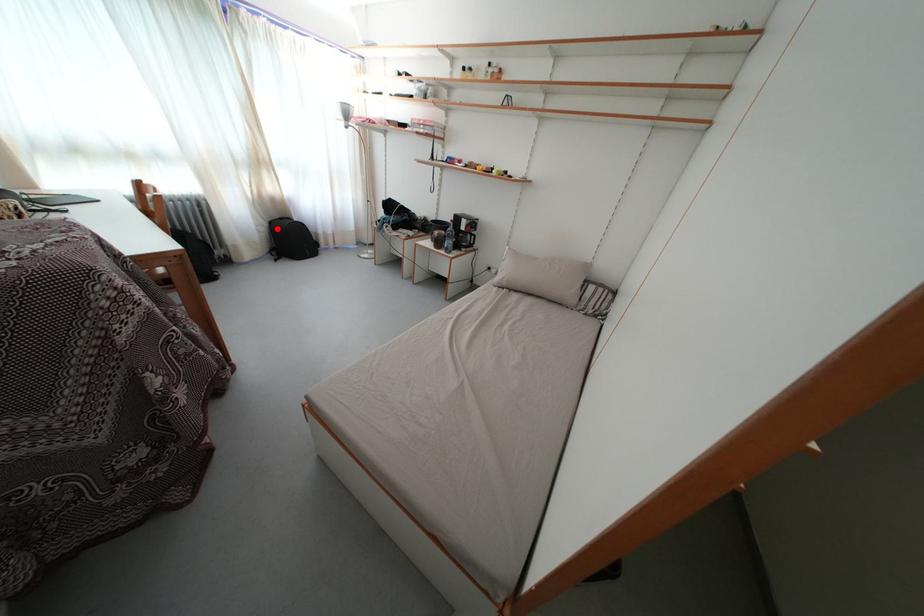
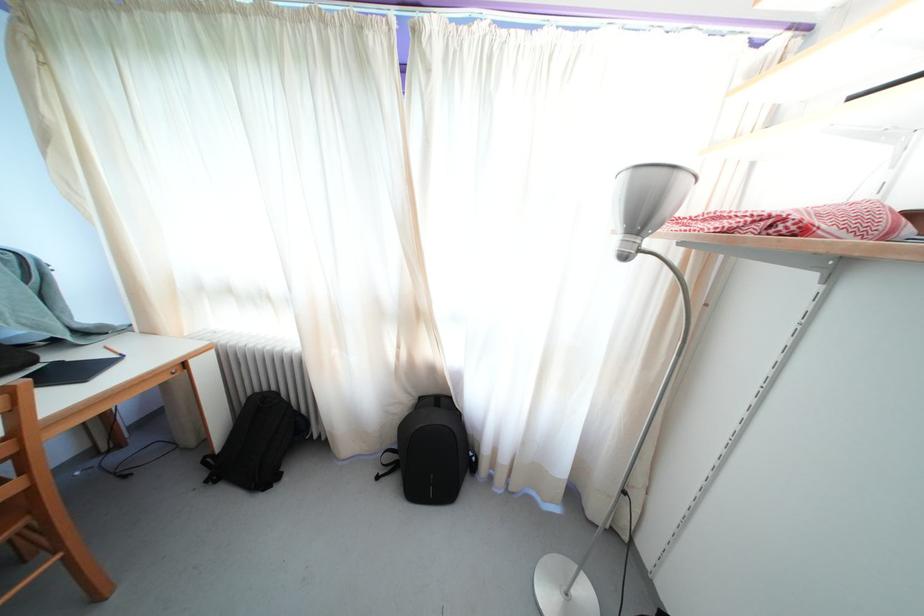
Find the pixel in the second image that matches the highlighted location in the first image.

(427, 405)